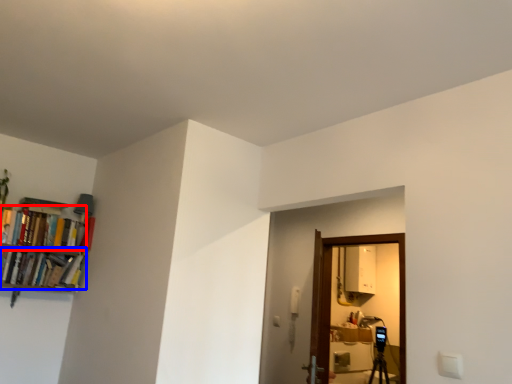
Question: Which of the following is the closest to the observer, book (highlighted by a red box) or book (highlighted by a blue box)?

Choices:
 (A) book
 (B) book

Answer: (B)